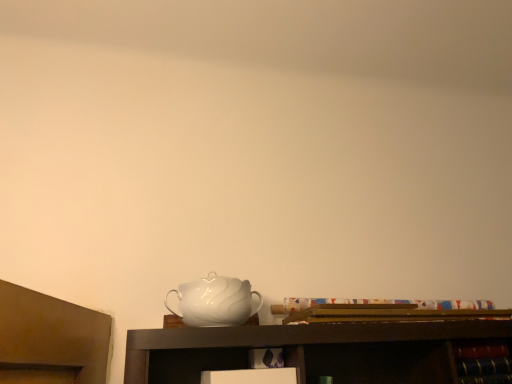
Question: Is white glossy jug at center thinner than wooden cabinet at lower right?

Choices:
 (A) yes
 (B) no

Answer: (B)

Question: Could you tell me if white glossy jug at center is turned towards wooden cabinet at lower right?

Choices:
 (A) no
 (B) yes

Answer: (A)

Question: Is white glossy jug at center to the right of wooden cabinet at lower right from the viewer's perspective?

Choices:
 (A) no
 (B) yes

Answer: (A)

Question: Is there a large distance between white glossy jug at center and wooden cabinet at lower right?

Choices:
 (A) yes
 (B) no

Answer: (B)

Question: From a real-world perspective, is white glossy jug at center over wooden cabinet at lower right?

Choices:
 (A) yes
 (B) no

Answer: (A)

Question: From the image's perspective, is white glossy jug at center beneath wooden cabinet at lower right?

Choices:
 (A) yes
 (B) no

Answer: (B)

Question: Is wooden cabinet at lower right taller than white glossy jug at center?

Choices:
 (A) no
 (B) yes

Answer: (A)

Question: Is wooden cabinet at lower right looking in the opposite direction of white glossy jug at center?

Choices:
 (A) no
 (B) yes

Answer: (A)

Question: Is the depth of wooden cabinet at lower right greater than that of white glossy jug at center?

Choices:
 (A) yes
 (B) no

Answer: (A)

Question: Considering the relative sizes of wooden cabinet at lower right and white glossy jug at center in the image provided, is wooden cabinet at lower right bigger than white glossy jug at center?

Choices:
 (A) yes
 (B) no

Answer: (B)

Question: Is wooden cabinet at lower right aimed at white glossy jug at center?

Choices:
 (A) no
 (B) yes

Answer: (A)

Question: Is wooden cabinet at lower right smaller than white glossy jug at center?

Choices:
 (A) yes
 (B) no

Answer: (A)

Question: Is white glossy jug at center bigger or smaller than wooden cabinet at lower right?

Choices:
 (A) small
 (B) big

Answer: (B)